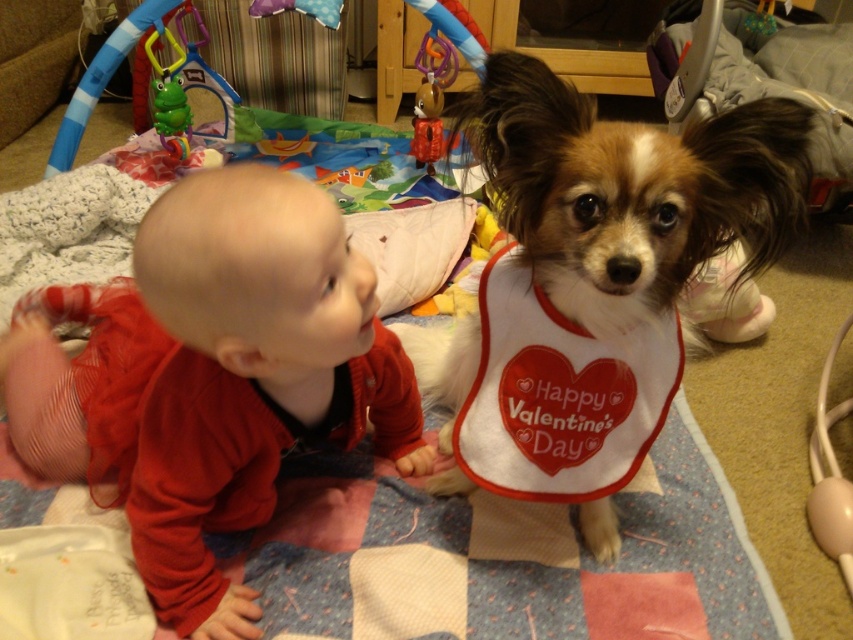
Who is higher up, matte red sweater at left or brown and white fur at center?

brown and white fur at center

Between matte red sweater at left and brown and white fur at center, which one has more height?

Standing taller between the two is brown and white fur at center.

Where is `matte red sweater at left`? matte red sweater at left is located at coordinates tap(212, 376).

Between brown and white fur at center and green rubber frog at upper left, which one is positioned higher?

green rubber frog at upper left

Between point (712, 218) and point (157, 132), which one is positioned behind?

The point (157, 132) is more distant.

What are the coordinates of `brown and white fur at center` in the screenshot? It's located at [595, 282].

Who is positioned more to the right, matte red sweater at left or white fabric bib at center?

white fabric bib at center is more to the right.

Does matte red sweater at left have a greater width compared to white fabric bib at center?

Yes, matte red sweater at left is wider than white fabric bib at center.

Who is more forward, (183, 627) or (602, 483)?

Point (183, 627) is in front.

Image resolution: width=853 pixels, height=640 pixels. Identify the location of matte red sweater at left. (212, 376).